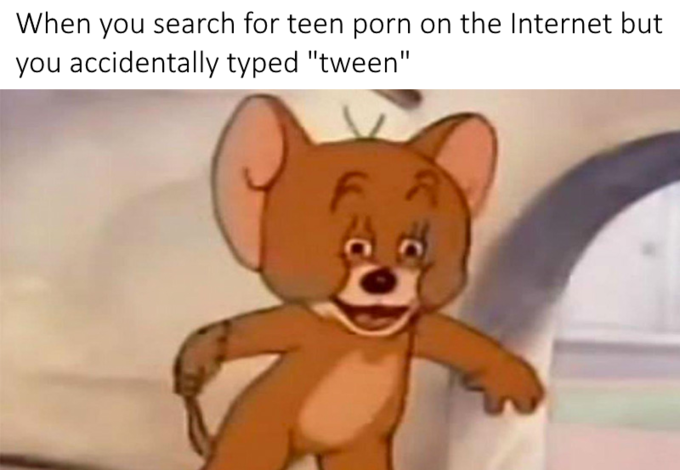
What are the coordinates of `mouse` in the screenshot? It's located at (375, 208).